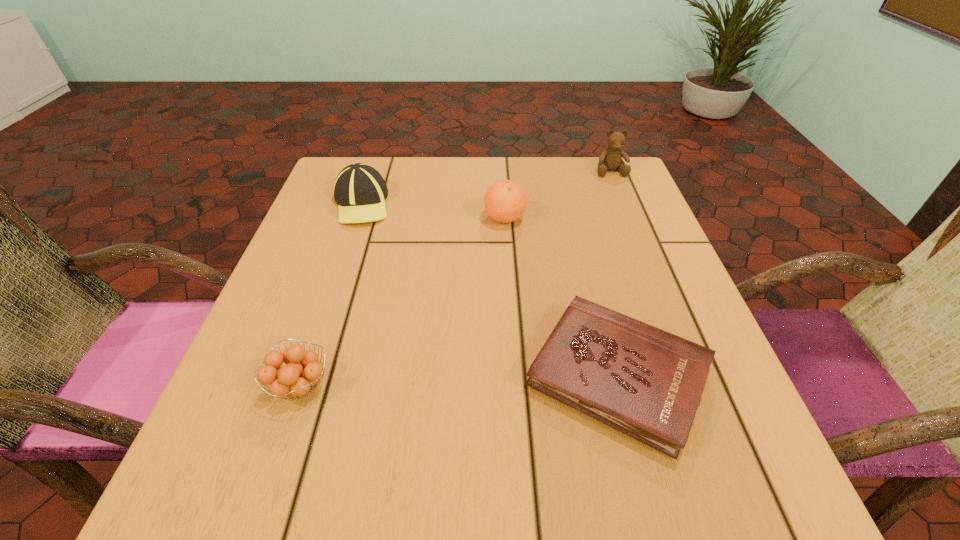
Where is `free space between the teddy bear and the left orange fruit`? free space between the teddy bear and the left orange fruit is located at coordinates (456, 278).

The height and width of the screenshot is (540, 960). I want to click on free space between the farthest object and the baseball cap, so coord(486,187).

Locate an element on the screen. This screenshot has width=960, height=540. vacant space that's between the taller orange fruit and the shortest object is located at coordinates (561, 297).

Locate an element on the screen. This screenshot has width=960, height=540. free spot between the baseball cap and the taller orange fruit is located at coordinates (433, 211).

The image size is (960, 540). I want to click on empty location between the taller orange fruit and the shortest object, so click(x=561, y=297).

The height and width of the screenshot is (540, 960). I want to click on free space between the baseball cap and the shortest object, so click(x=489, y=290).

Where is `empty location between the shortest object and the nearer orange fruit`? empty location between the shortest object and the nearer orange fruit is located at coordinates [x=459, y=381].

You are a GUI agent. You are given a task and a screenshot of the screen. Output one action in this format:
    pyautogui.click(x=<x>, y=<y>)
    Task: Click on the free point between the baseball cap and the teddy bear
    
    Given the screenshot: What is the action you would take?
    pyautogui.click(x=486, y=187)

At what (x,y) coordinates should I click in order to perform the action: click on free area in between the baseball cap and the shorter orange fruit. Please return your answer as a coordinate pair (x, y). Looking at the image, I should click on (331, 294).

Locate which object is the third closest to the shortest object. Please provide its 2D coordinates. Your answer should be formatted as a tuple, i.e. [(x, y)], where the tuple contains the x and y coordinates of a point satisfying the conditions above.

[(360, 191)]